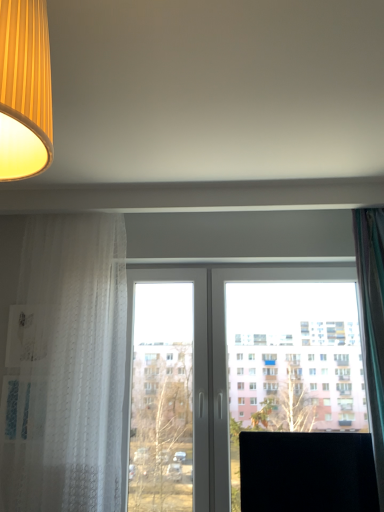
Question: From a real-world perspective, is black matte computer monitor at lower right positioned under matte yellow fabric lampshade at upper left based on gravity?

Choices:
 (A) no
 (B) yes

Answer: (B)

Question: Is black matte computer monitor at lower right aimed at matte yellow fabric lampshade at upper left?

Choices:
 (A) no
 (B) yes

Answer: (A)

Question: Would you say black matte computer monitor at lower right is a long distance from matte yellow fabric lampshade at upper left?

Choices:
 (A) no
 (B) yes

Answer: (B)

Question: From the image's perspective, is black matte computer monitor at lower right below matte yellow fabric lampshade at upper left?

Choices:
 (A) yes
 (B) no

Answer: (A)

Question: Are black matte computer monitor at lower right and matte yellow fabric lampshade at upper left beside each other?

Choices:
 (A) no
 (B) yes

Answer: (A)

Question: Is black matte computer monitor at lower right positioned with its back to matte yellow fabric lampshade at upper left?

Choices:
 (A) yes
 (B) no

Answer: (B)

Question: Is transparent glass window at center surrounded by white sheer curtain at left, the 1th curtain viewed from the left?

Choices:
 (A) no
 (B) yes

Answer: (A)

Question: Can you confirm if white sheer curtain at left, the 1th curtain viewed from the left, is shorter than transparent glass window at center?

Choices:
 (A) no
 (B) yes

Answer: (A)

Question: Are white sheer curtain at left, placed as the second curtain when sorted from right to left, and transparent glass window at center located far from each other?

Choices:
 (A) no
 (B) yes

Answer: (A)

Question: Is white sheer curtain at left, the 1th curtain viewed from the left, beside transparent glass window at center?

Choices:
 (A) no
 (B) yes

Answer: (A)

Question: From a real-world perspective, is white sheer curtain at left, placed as the second curtain when sorted from right to left, positioned under transparent glass window at center based on gravity?

Choices:
 (A) yes
 (B) no

Answer: (B)

Question: From the image's perspective, would you say white sheer curtain at left, placed as the second curtain when sorted from right to left, is positioned over transparent glass window at center?

Choices:
 (A) no
 (B) yes

Answer: (B)

Question: Considering the relative sizes of white sheer curtain at left, placed as the second curtain when sorted from right to left, and matte yellow fabric lampshade at upper left in the image provided, is white sheer curtain at left, placed as the second curtain when sorted from right to left, taller than matte yellow fabric lampshade at upper left?

Choices:
 (A) no
 (B) yes

Answer: (B)